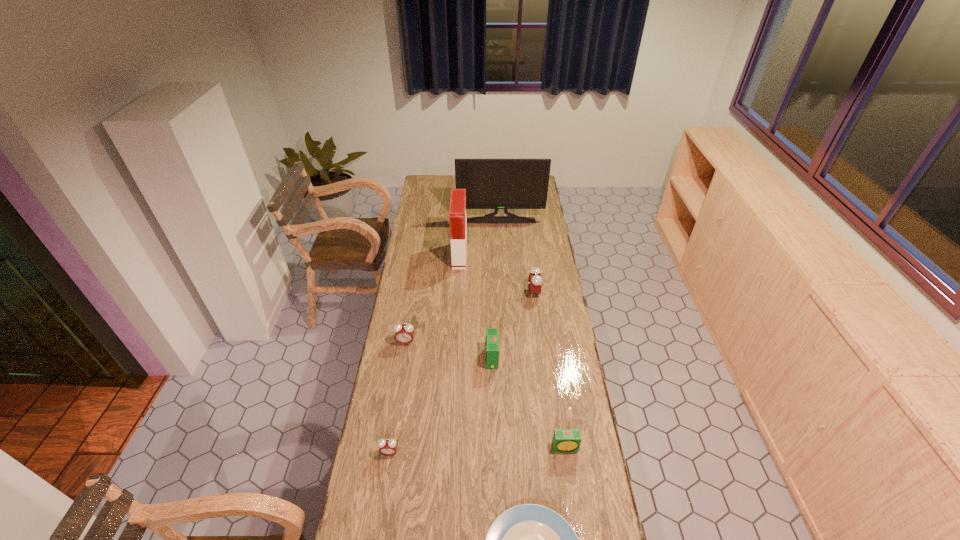
Locate an element on the screen. The height and width of the screenshot is (540, 960). the farthest object is located at coordinates (496, 184).

The image size is (960, 540). Identify the location of cigarette_case. (457, 213).

Locate an element on the screen. red cigarette_case is located at coordinates (457, 213).

At what (x,y) coordinates should I click in order to perform the action: click on the farthest alarm clock. Please return your answer as a coordinate pair (x, y). Looking at the image, I should click on (534, 280).

The height and width of the screenshot is (540, 960). What are the coordinates of `the sixth shortest object` in the screenshot? It's located at (534, 280).

Find the location of a particular element. The height and width of the screenshot is (540, 960). the fifth nearest object is located at coordinates (404, 334).

Find the location of a particular element. The width and height of the screenshot is (960, 540). the second smallest pink alarm clock is located at coordinates (404, 334).

I want to click on the third farthest alarm clock, so click(492, 338).

Where is `the bigger green alarm clock`? This screenshot has width=960, height=540. the bigger green alarm clock is located at coordinates (492, 338).

Where is `the nearest pink alarm clock`? The height and width of the screenshot is (540, 960). the nearest pink alarm clock is located at coordinates (388, 447).